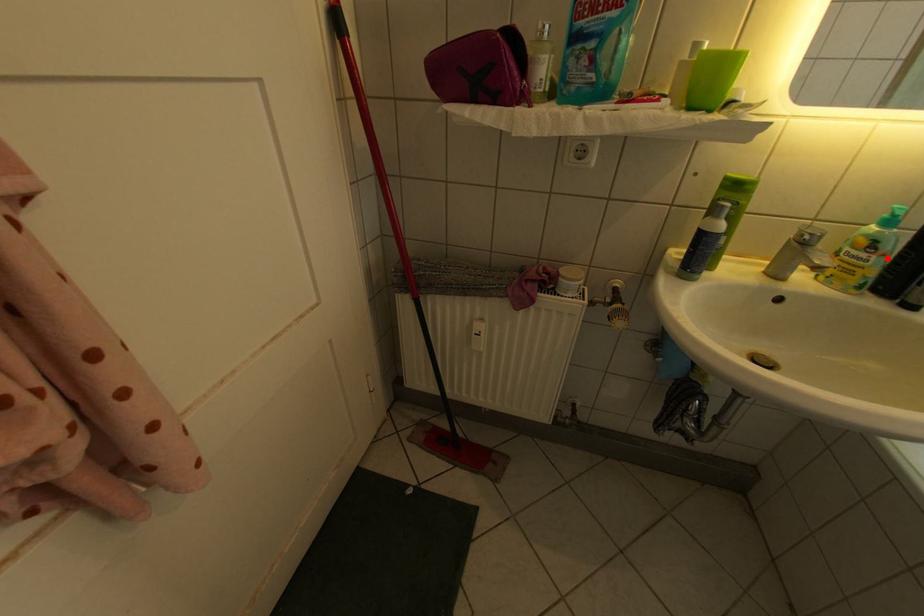
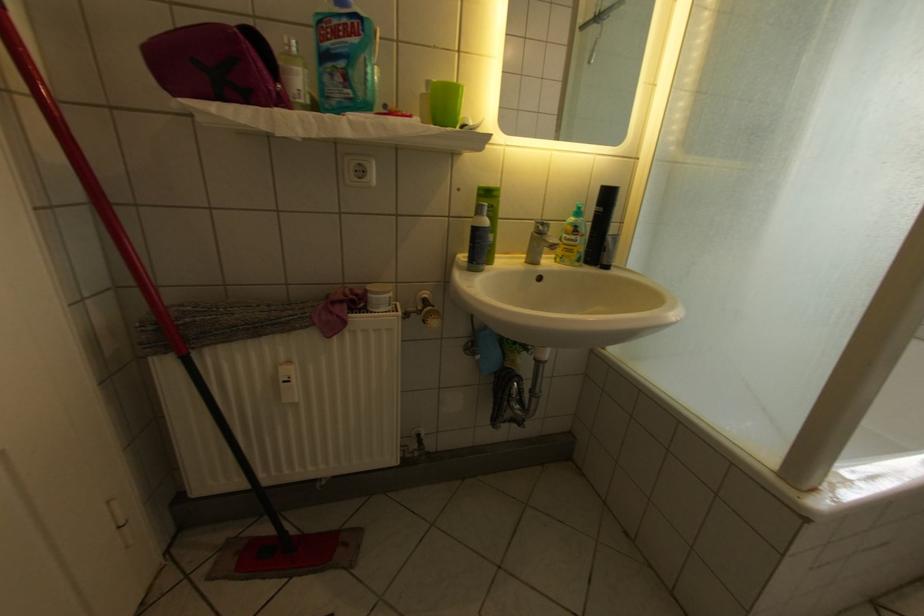
Question: A red point is marked in image1. In image2, is the corresponding 3D point closer to the camera or farther? Reply with the corresponding letter.

Choices:
 (A) The corresponding 3D point is closer.
 (B) The corresponding 3D point is farther.

Answer: (A)